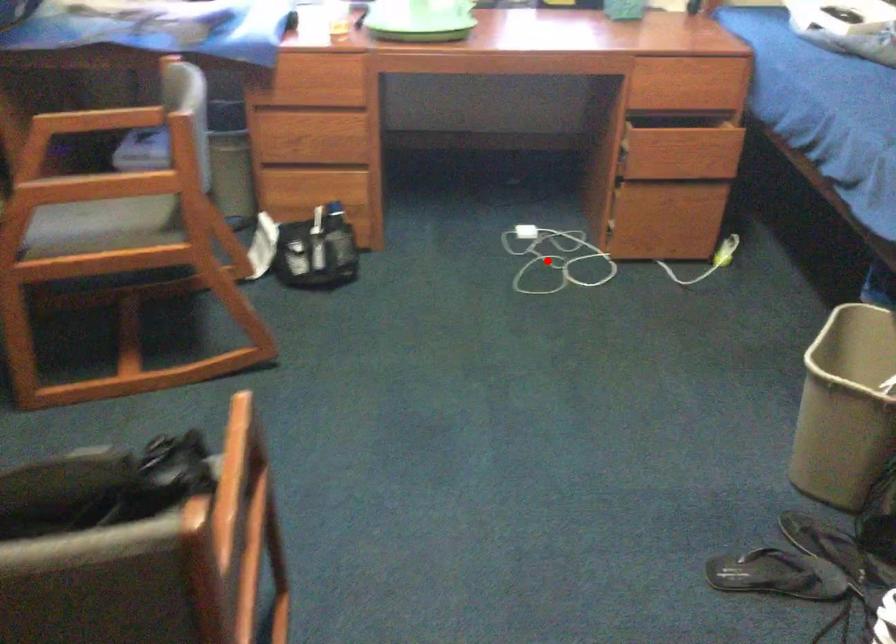
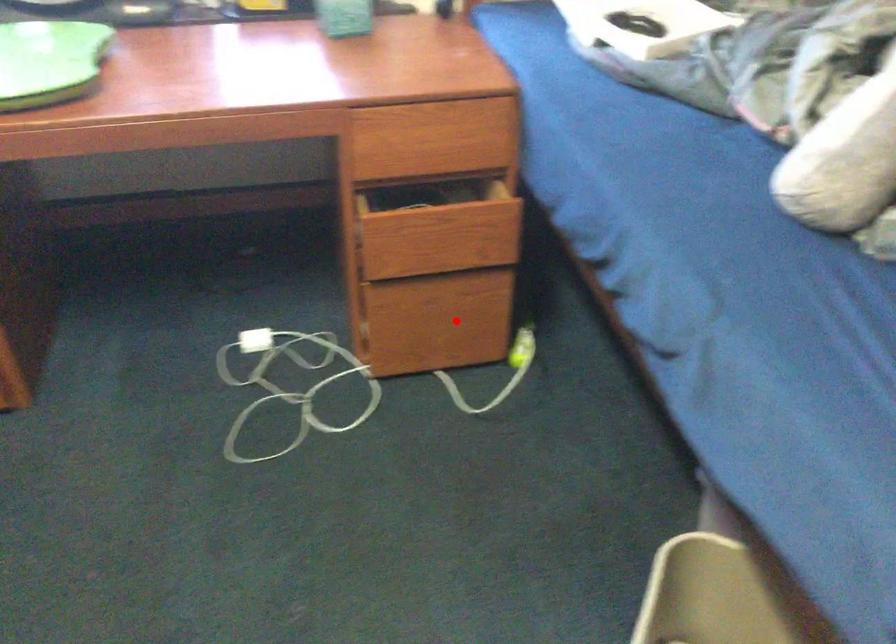
I am providing you with two images of the same scene from different viewpoints. A red point is marked on the first image and another point is marked on the second image. Do the highlighted points in image1 and image2 indicate the same real-world spot?

No